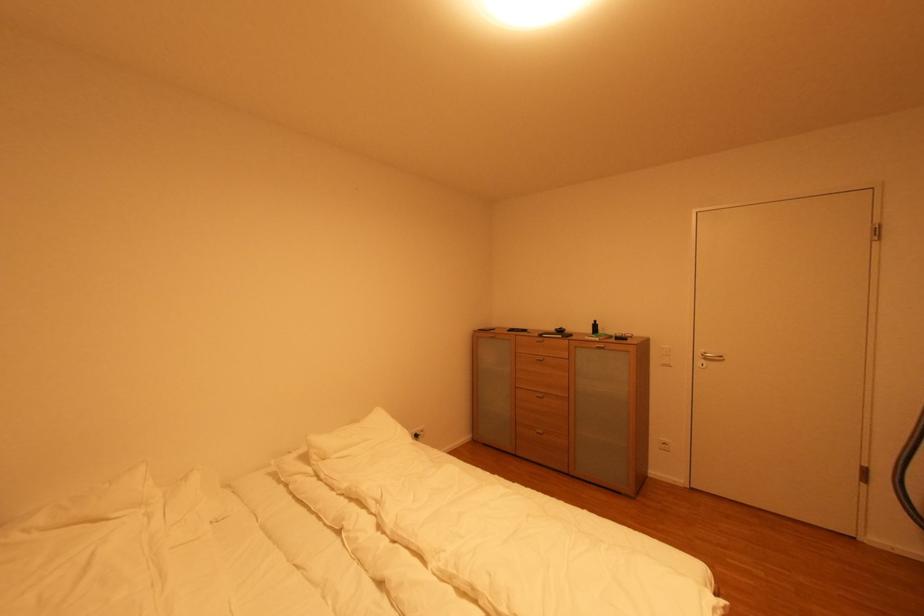
Find where to pull the silver drawer handle. Please return your answer as a coordinate pair (x, y).

(537, 361)